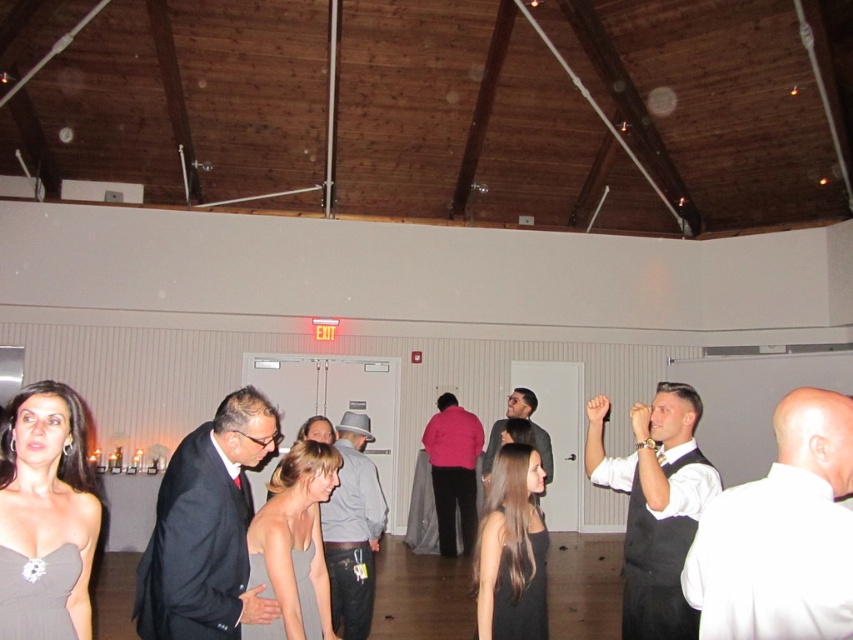
You are a guest at this event and need to pass by the white satin vest at right and the black satin suit at center to reach the exit. Can you comfortably walk between them without touching either?

The distance between the white satin vest at right and the black satin suit at center is 1.52 meters. A typical person requires about 0.7 meters of space to walk comfortably, so yes, there is sufficient space to pass between them without touching either.

You are a photographer at this event and need to position yourself so that both the black satin suit at center and the matte black dress at lower left are in your frame. Given that your camera has a fixed focus that prioritizes taller subjects, which subject will be in focus?

The black satin suit at center will be in focus because it is taller than the matte black dress at lower left, and the camera prioritizes taller subjects.